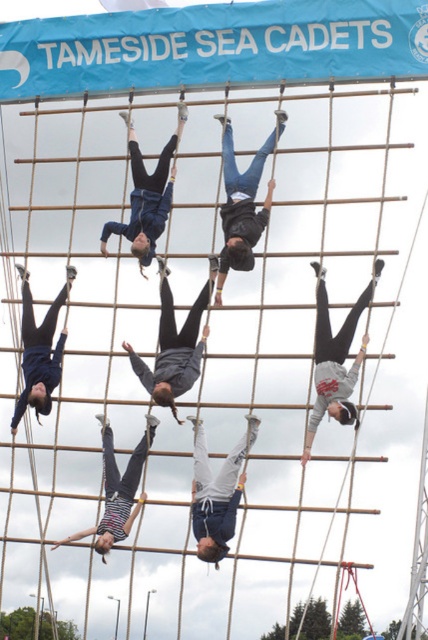
Question: Based on their relative distances, which object is nearer to the white cotton shirt at center?

Choices:
 (A) jeans at center
 (B) gray sweatshirt at center
 (C) striped fabric pants at center
 (D) dark blue sweatshirt at upper center

Answer: (C)

Question: Which point is closer to the camera?

Choices:
 (A) jeans at center
 (B) dark gray hoodie at center
 (C) striped fabric pants at center
 (D) gray sweatshirt at center

Answer: (D)

Question: Does dark gray hoodie at center appear on the left side of jeans at center?

Choices:
 (A) no
 (B) yes

Answer: (B)

Question: Which of the following is the closest to the observer?

Choices:
 (A) dark gray hoodie at center
 (B) matte black pants at left
 (C) white cotton shirt at center
 (D) striped fabric pants at center

Answer: (C)

Question: Is dark gray hoodie at center below jeans at center?

Choices:
 (A) no
 (B) yes

Answer: (B)

Question: Can you confirm if jeans at center is bigger than white cotton shirt at center?

Choices:
 (A) no
 (B) yes

Answer: (B)